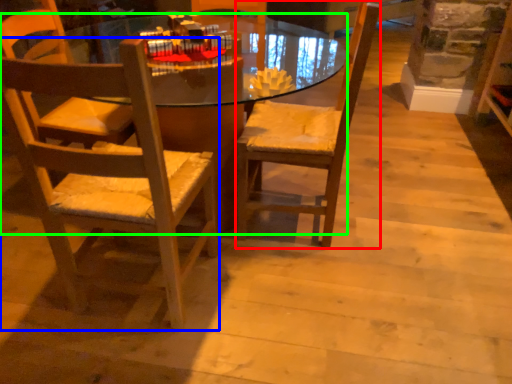
Question: Based on their relative distances, which object is farther from chair (highlighted by a red box)? Choose from chair (highlighted by a blue box) and desk (highlighted by a green box).

Choices:
 (A) chair
 (B) desk

Answer: (B)